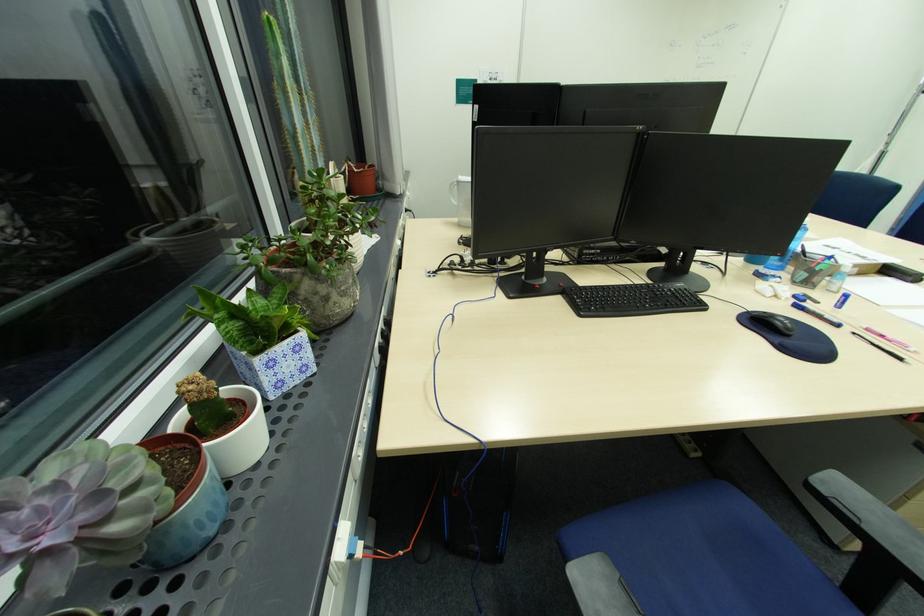
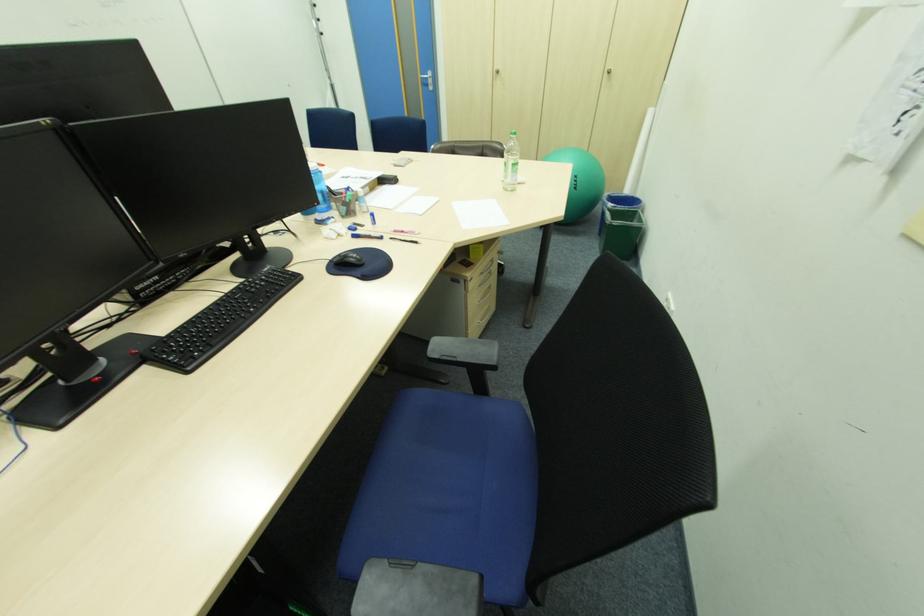
How did the camera likely rotate?

The rotation direction of the camera is right-down.